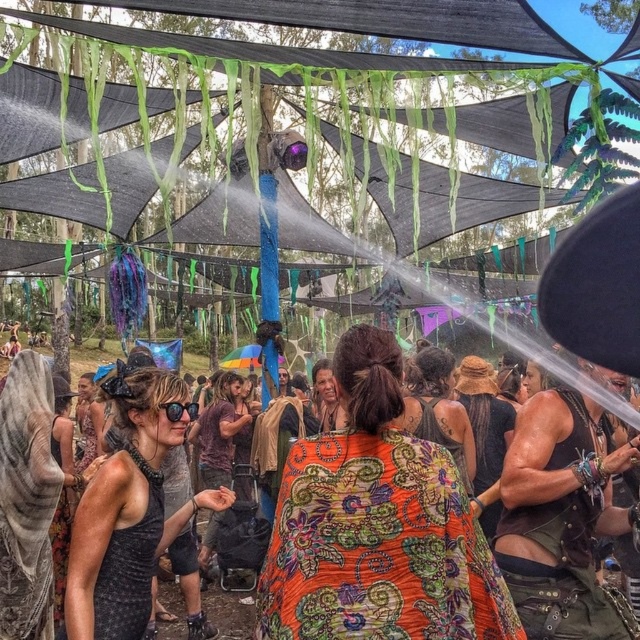
You are a photographer at the festival and want to capture a photo that includes both the orange floral fabric at center and the leather vest at center. Which object should you focus on first to ensure both are in frame, considering their sizes?

The orange floral fabric at center is wider than the leather vest at center, so you should focus on the orange floral fabric at center first to ensure both are in frame.

You are organizing a photo shoot and need to ensure that the orange floral fabric at center and the black mesh tank top at center are both visible in the frame. Given their sizes, which object will require more horizontal space to fully capture in the photograph?

The orange floral fabric at center requires more horizontal space because its width surpasses that of the black mesh tank top at center.